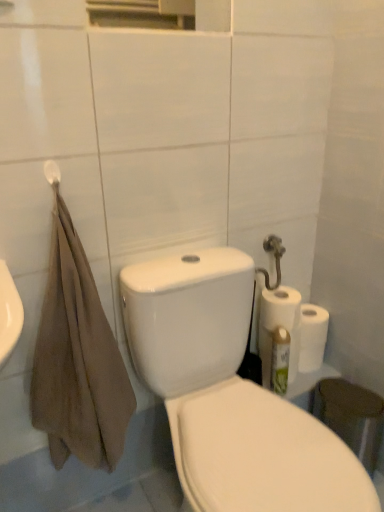
Question: From the image's perspective, is white matte towel bar at upper left located above white matte paper towel at right?

Choices:
 (A) yes
 (B) no

Answer: (A)

Question: Is the position of white matte towel bar at upper left more distant than that of white matte paper towel at right?

Choices:
 (A) no
 (B) yes

Answer: (A)

Question: Is white matte paper towel at right at the back of white matte towel bar at upper left?

Choices:
 (A) yes
 (B) no

Answer: (B)

Question: Considering the relative sizes of white matte towel bar at upper left and white matte paper towel at right in the image provided, is white matte towel bar at upper left taller than white matte paper towel at right?

Choices:
 (A) no
 (B) yes

Answer: (A)

Question: From the image's perspective, is white matte towel bar at upper left under white matte paper towel at right?

Choices:
 (A) yes
 (B) no

Answer: (B)

Question: From the image's perspective, is brown cotton towel at left positioned above or below green matte cleaning product at right?

Choices:
 (A) above
 (B) below

Answer: (A)

Question: Is brown cotton towel at left wider or thinner than green matte cleaning product at right?

Choices:
 (A) wide
 (B) thin

Answer: (A)

Question: Does point (74, 501) appear closer or farther from the camera than point (286, 365)?

Choices:
 (A) farther
 (B) closer

Answer: (B)

Question: Looking at the image, does brown cotton towel at left seem bigger or smaller compared to green matte cleaning product at right?

Choices:
 (A) small
 (B) big

Answer: (B)

Question: From a real-world perspective, is white glossy porcelain at center above or below brown cotton towel at left?

Choices:
 (A) above
 (B) below

Answer: (B)

Question: Looking at the image, does white glossy porcelain at center seem bigger or smaller compared to brown cotton towel at left?

Choices:
 (A) small
 (B) big

Answer: (B)

Question: Looking at their shapes, would you say white glossy porcelain at center is wider or thinner than brown cotton towel at left?

Choices:
 (A) wide
 (B) thin

Answer: (A)

Question: Considering their positions, is white glossy porcelain at center located in front of or behind brown cotton towel at left?

Choices:
 (A) front
 (B) behind

Answer: (A)

Question: In terms of size, does green matte cleaning product at right appear bigger or smaller than white glossy porcelain at center?

Choices:
 (A) big
 (B) small

Answer: (B)

Question: From a real-world perspective, is green matte cleaning product at right physically located above or below white glossy porcelain at center?

Choices:
 (A) below
 (B) above

Answer: (A)